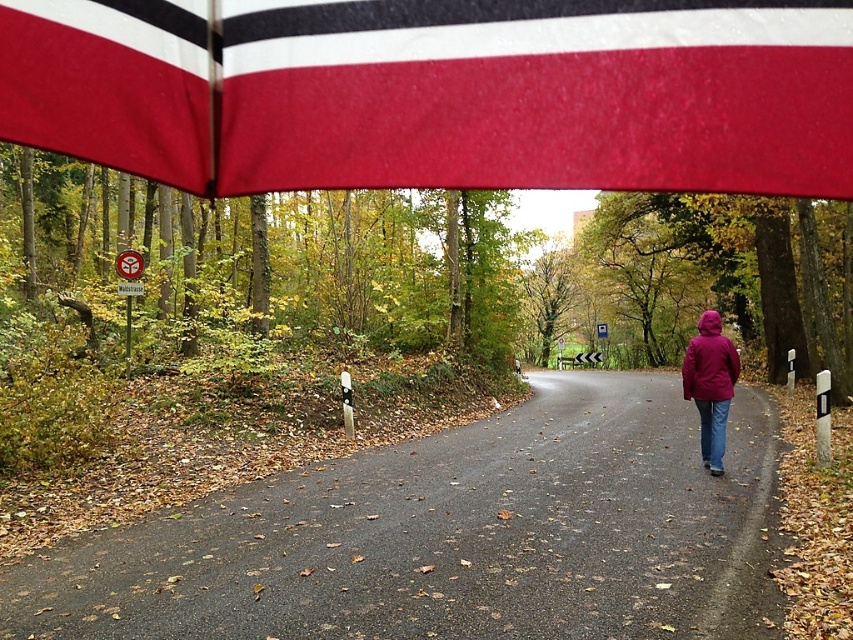
You are standing under the red fabric flag at upper center and want to walk to the brown asphalt road at center. Which direction should you head to reach it?

The brown asphalt road at center is located below the red fabric flag at upper center, so you should walk downward from the red fabric flag at upper center to reach the brown asphalt road at center.

You are standing on the brown asphalt road at center and want to walk towards the matte purple jacket at right. Which direction should you head?

The brown asphalt road at center is positioned on the left side of the matte purple jacket at right, so you should walk to the right to reach the matte purple jacket at right.